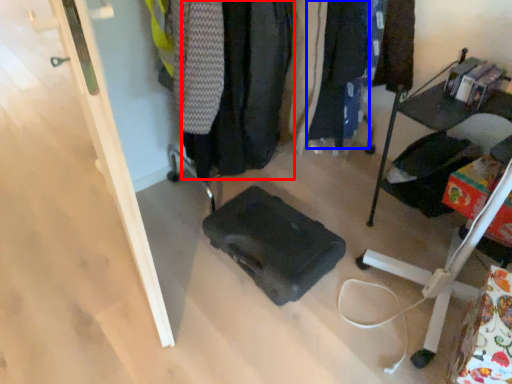
Question: Which object is closer to the camera taking this photo, clothing (highlighted by a red box) or clothing (highlighted by a blue box)?

Choices:
 (A) clothing
 (B) clothing

Answer: (A)